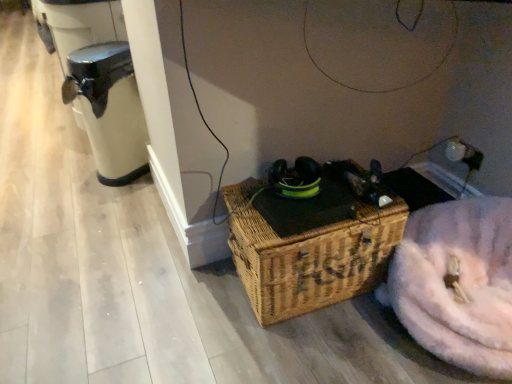
Locate an element on the screen. free spot in front of woven brown picnic basket at center is located at coordinates (317, 347).